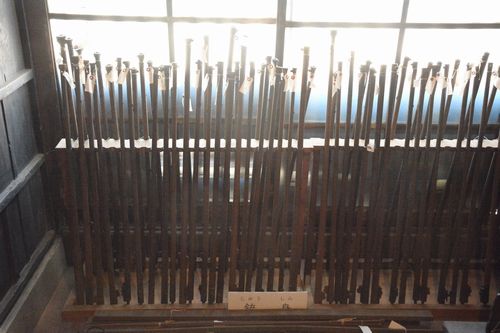
This screenshot has width=500, height=333. What are the coordinates of `display/holder` in the screenshot? It's located at (160, 303), (285, 282).